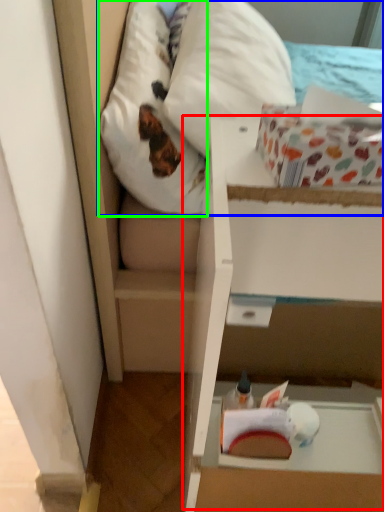
Question: Which object is the closest to the cardboard box (highlighted by a red box)? Choose among these: mattress (highlighted by a blue box) or pillow (highlighted by a green box).

Choices:
 (A) mattress
 (B) pillow

Answer: (B)